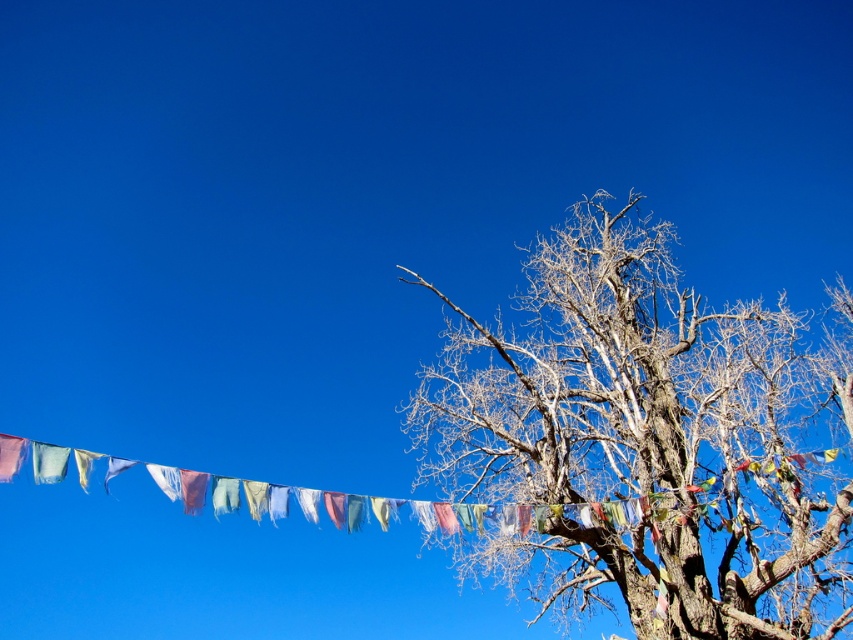
You are standing at the point with coordinates (648, 440) in the image. What object is located exactly at this point?

The point at coordinates (648, 440) is occupied by the dead wood tree at right.

You are planning to hang a new flag on the dead wood tree at right. Considering the size of the tree and the existing matte blue flag at upper left, will the new flag be more noticeable if placed closer to the tree trunk or further away near the flag at upper left?

The dead wood tree at right has a larger size compared to matte blue flag at upper left. Placing the new flag closer to the tree trunk would make it more noticeable because the larger tree provides a contrasting backdrop, making the flag stand out more than if it were near the smaller matte blue flag at upper left.

You are a bird looking for a place to perch. You see the dead wood tree at right and the matte blue flag at upper left. Which object is taller and would provide a better vantage point?

The dead wood tree at right is taller than the matte blue flag at upper left, so it would provide a better vantage point for perching.